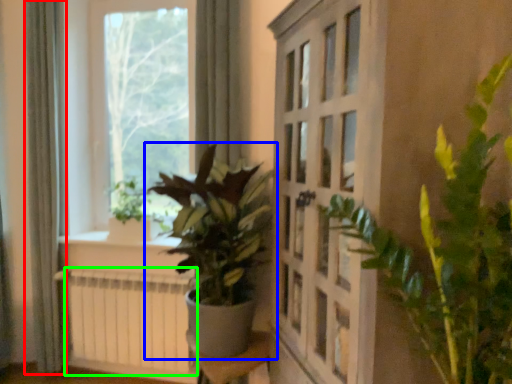
Question: Based on their relative distances, which object is nearer to curtain (highlighted by a red box)? Choose from houseplant (highlighted by a blue box) and radiator (highlighted by a green box).

Choices:
 (A) houseplant
 (B) radiator

Answer: (B)